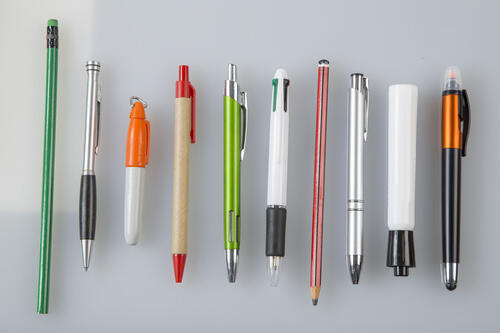
Identify the location of writing utensil. (42, 273), (93, 229), (139, 199), (175, 203), (236, 206), (279, 192), (314, 190), (359, 183), (397, 178), (470, 174).